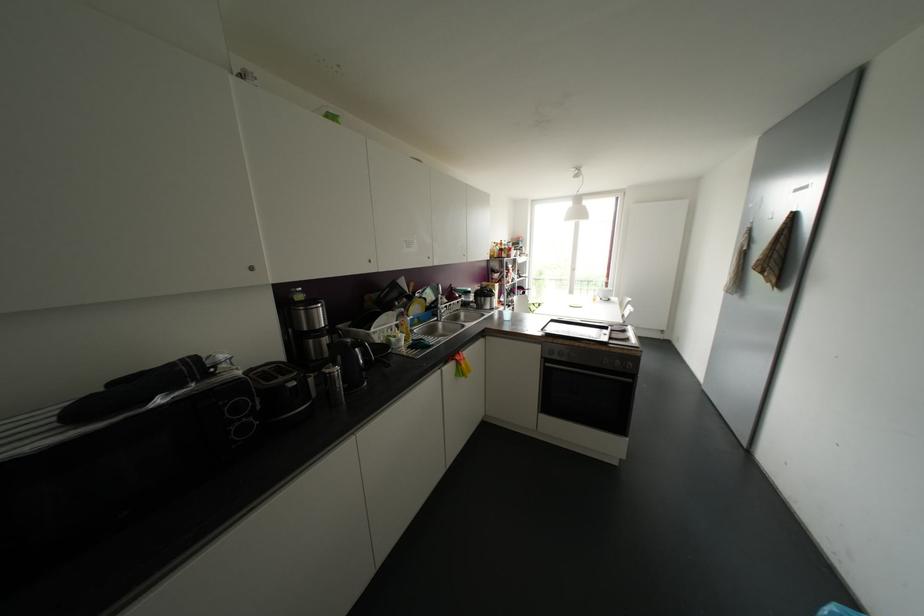
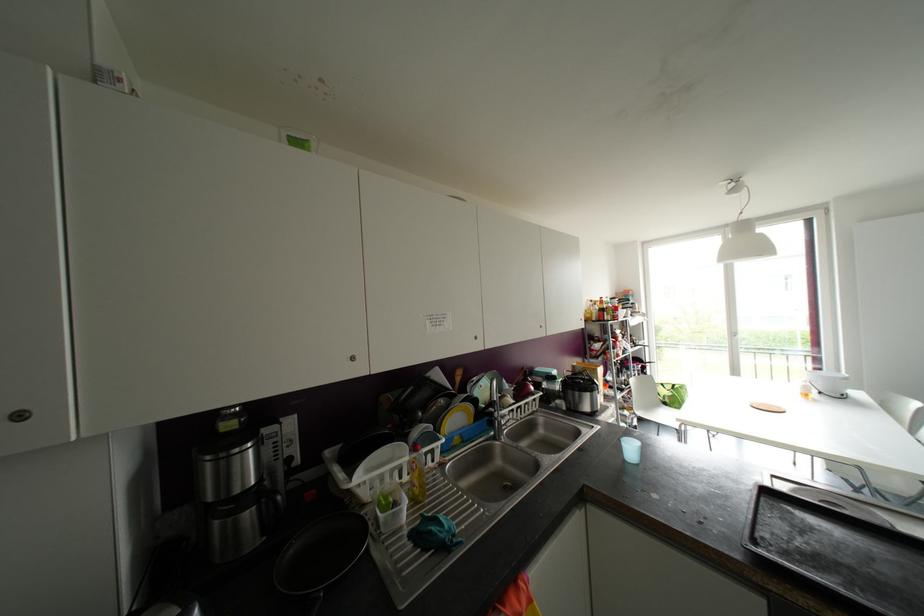
The point at (250, 268) is marked in the first image. Where is the corresponding point in the second image?

(19, 416)